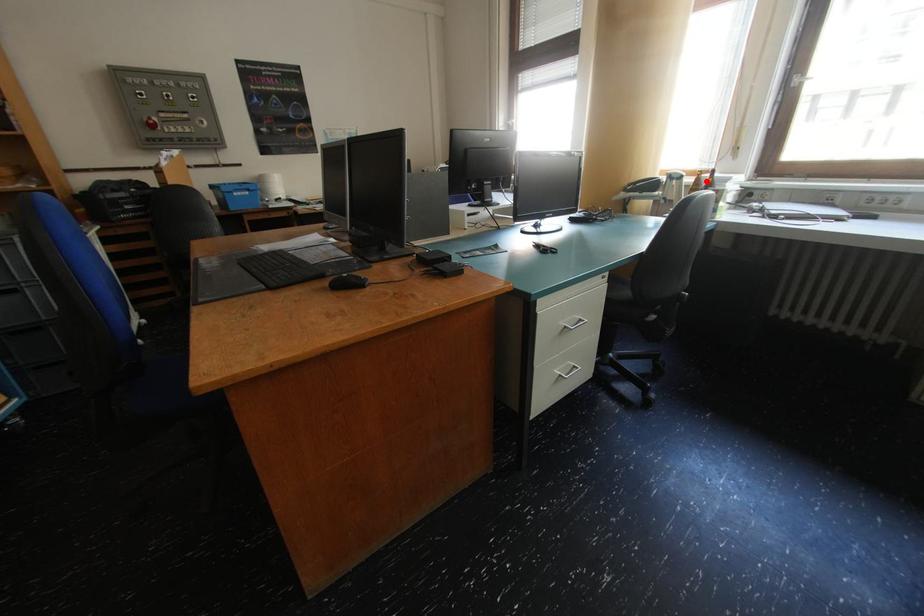
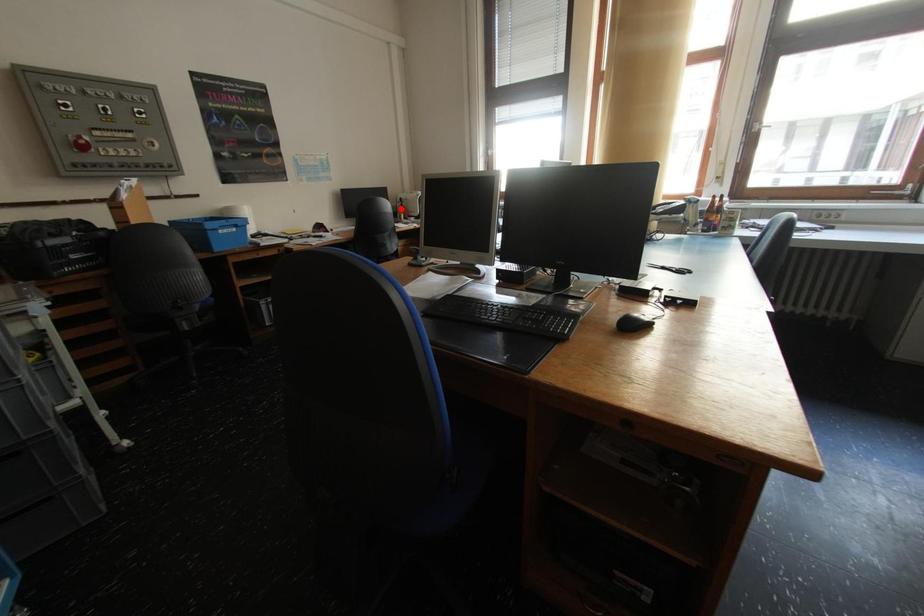
I am providing you with two images of the same scene from different viewpoints. A red point is marked on the first image and another point is marked on the second image. Does the point marked in image1 correspond to the same location as the one in image2?

No